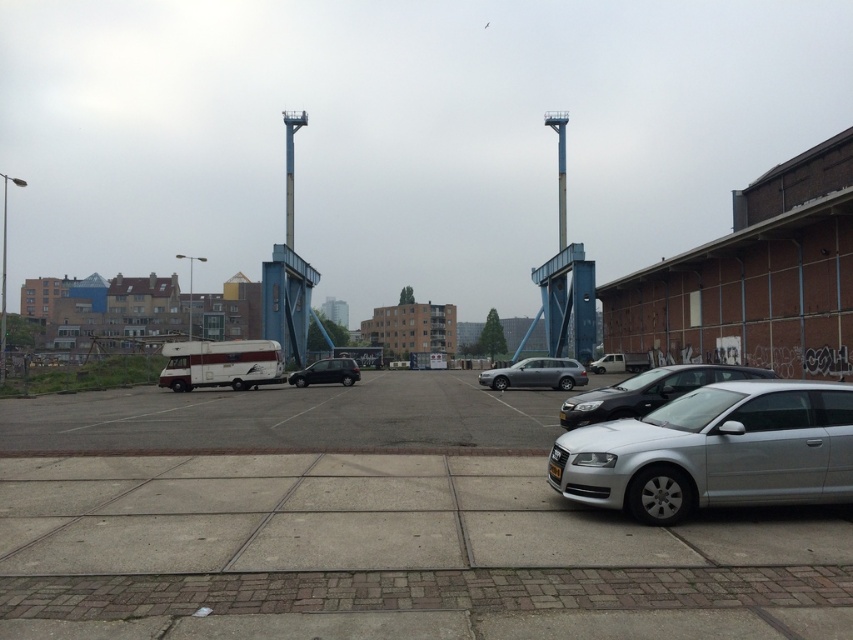
Question: Does silver metallic car at center have a smaller size compared to satin silver sedan at center?

Choices:
 (A) yes
 (B) no

Answer: (B)

Question: Which object is closer to the camera taking this photo?

Choices:
 (A) silver metallic car at lower right
 (B) silver metallic car at center

Answer: (A)

Question: Is silver metallic car at lower right bigger than silver metallic car at center?

Choices:
 (A) no
 (B) yes

Answer: (A)

Question: Estimate the real-world distances between objects in this image. Which object is farther from the satin silver sedan at center?

Choices:
 (A) silver metallic car at center
 (B) silver metallic car at lower right

Answer: (B)

Question: In this image, where is silver metallic car at center located relative to satin black van at center?

Choices:
 (A) right
 (B) left

Answer: (A)

Question: Which is nearer to the silver metallic car at center?

Choices:
 (A) white matte van at center
 (B) satin black van at center

Answer: (B)